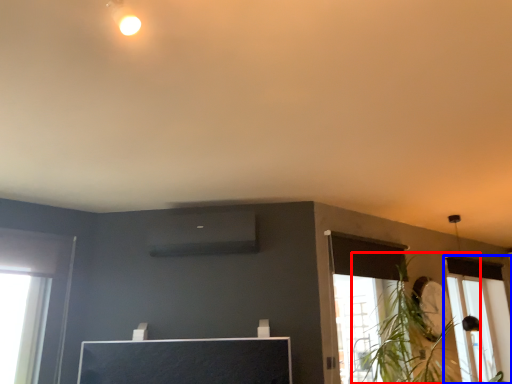
Question: Which object is further to the camera taking this photo, plant (highlighted by a red box) or window (highlighted by a blue box)?

Choices:
 (A) plant
 (B) window

Answer: (B)